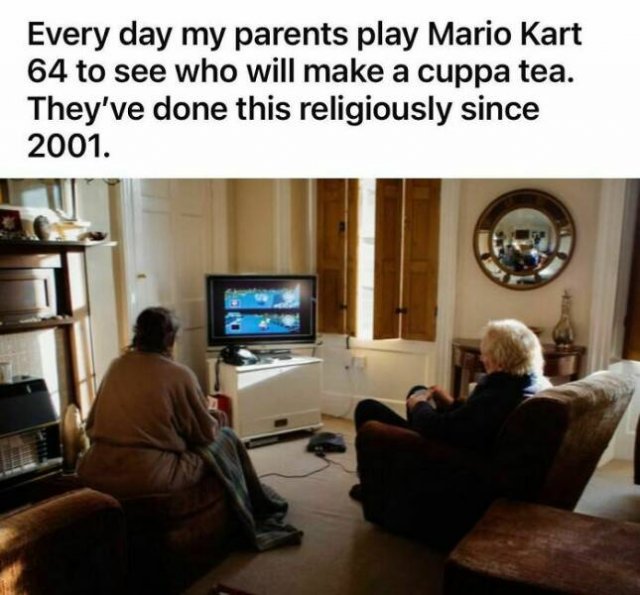
Where is `fireplace`? The height and width of the screenshot is (595, 640). fireplace is located at coordinates (38, 403).